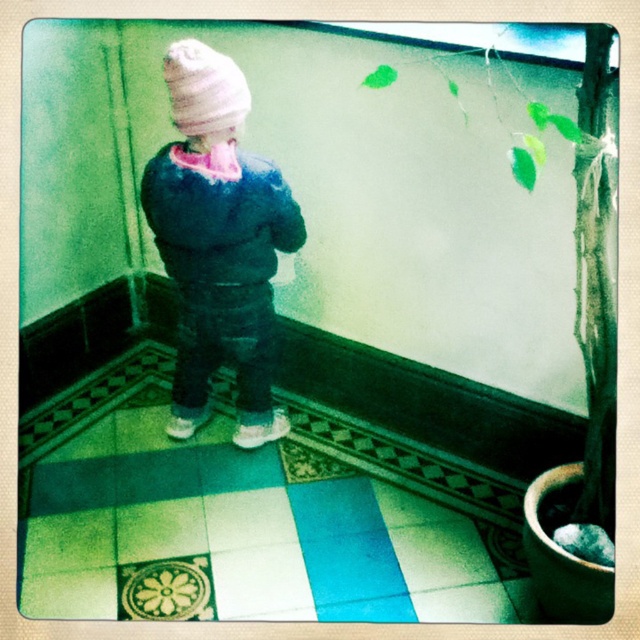
Consider the image. Can you confirm if fuzzy blue jacket at center is positioned below white knit hat at upper center?

Yes, fuzzy blue jacket at center is below white knit hat at upper center.

Is point (196, 298) farther from camera compared to point (248, 93)?

Yes, it is behind point (248, 93).

Does point (252, 333) come closer to viewer compared to point (216, 58)?

No, it is behind (216, 58).

I want to click on fuzzy blue jacket at center, so click(218, 241).